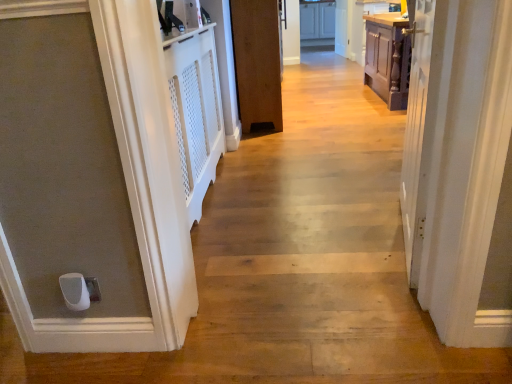
Question: In terms of width, does white glossy cabinets at upper center look wider or thinner when compared to brown wood door at center?

Choices:
 (A) thin
 (B) wide

Answer: (B)

Question: Relative to brown wood door at center, is white glossy cabinets at upper center in front or behind?

Choices:
 (A) front
 (B) behind

Answer: (B)

Question: Is white glossy cabinets at upper center bigger or smaller than brown wood door at center?

Choices:
 (A) small
 (B) big

Answer: (A)

Question: Is brown wood door at center spatially inside white glossy cabinets at upper center, or outside of it?

Choices:
 (A) inside
 (B) outside

Answer: (B)

Question: Does point (270, 59) appear closer or farther from the camera than point (331, 31)?

Choices:
 (A) closer
 (B) farther

Answer: (A)

Question: From the image's perspective, is brown wood door at center positioned above or below white glossy cabinets at upper center?

Choices:
 (A) below
 (B) above

Answer: (A)

Question: From a real-world perspective, is brown wood door at center physically located above or below white glossy cabinets at upper center?

Choices:
 (A) above
 (B) below

Answer: (A)